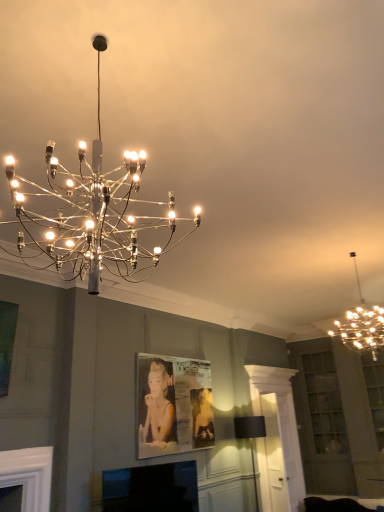
What is the approximate height of metallic chandelier at upper right, which ranks as the first lamp in right-to-left order?

metallic chandelier at upper right, which ranks as the first lamp in right-to-left order, is 4.23 feet tall.

The height and width of the screenshot is (512, 384). Identify the location of black glossy tv at lower center. (151, 488).

In order to face black fabric lampshade at lower center, placed as the third lamp when sorted from top to bottom, should I rotate leftwards or rightwards?

Rotate right and turn 8.089 degrees.

The image size is (384, 512). Find the location of `metallic silver picture frame at center`. metallic silver picture frame at center is located at coordinates (173, 405).

Is point (166, 472) positioned after point (26, 200)?

Yes.

Can you confirm if black glossy tv at lower center is wider than metallic chandelier at upper center, which is counted as the third lamp, starting from the right?

No.

Is black glossy tv at lower center to the right of metallic chandelier at upper center, placed as the 3th lamp when sorted from bottom to top, from the viewer's perspective?

Incorrect, black glossy tv at lower center is not on the right side of metallic chandelier at upper center, placed as the 3th lamp when sorted from bottom to top.

Who is taller, black glossy tv at lower center or metallic chandelier at upper center, the 1th lamp from the left?

metallic chandelier at upper center, the 1th lamp from the left.

Is metallic silver picture frame at center spatially inside black glossy tv at lower center, or outside of it?

metallic silver picture frame at center exists outside the volume of black glossy tv at lower center.

Does point (166, 430) appear closer or farther from the camera than point (176, 483)?

Point (166, 430) is positioned farther from the camera compared to point (176, 483).

Between metallic silver picture frame at center and black glossy tv at lower center, which one is positioned behind?

metallic silver picture frame at center is more distant.

Considering the sizes of metallic silver picture frame at center and metallic chandelier at upper right, marked as the second lamp in a bottom-to-top arrangement, in the image, is metallic silver picture frame at center wider or thinner than metallic chandelier at upper right, marked as the second lamp in a bottom-to-top arrangement,?

metallic silver picture frame at center is thinner than metallic chandelier at upper right, marked as the second lamp in a bottom-to-top arrangement.

Which of these two, metallic silver picture frame at center or metallic chandelier at upper right, the second lamp from the front, stands taller?

Standing taller between the two is metallic silver picture frame at center.

Which is more to the left, metallic silver picture frame at center or metallic chandelier at upper right, marked as the second lamp in a bottom-to-top arrangement?

From the viewer's perspective, metallic silver picture frame at center appears more on the left side.

Consider the image. Is metallic chandelier at upper right, which ranks as the first lamp in right-to-left order, far from black glossy tv at lower center?

metallic chandelier at upper right, which ranks as the first lamp in right-to-left order, is positioned a significant distance from black glossy tv at lower center.

Between metallic chandelier at upper right, which appears as the second lamp when viewed from the back, and black glossy tv at lower center, which one has smaller size?

black glossy tv at lower center.

Looking at this image, is black glossy tv at lower center located within metallic chandelier at upper right, which ranks as the 3th lamp in left-to-right order?

Definitely not — black glossy tv at lower center is not inside metallic chandelier at upper right, which ranks as the 3th lamp in left-to-right order.

Is metallic chandelier at upper right, which appears as the second lamp when viewed from the back, taller than black glossy tv at lower center?

Yes.

Which is more to the left, metallic silver picture frame at center or metallic chandelier at upper center, placed as the 3th lamp when sorted from bottom to top?

metallic chandelier at upper center, placed as the 3th lamp when sorted from bottom to top.

Are metallic silver picture frame at center and metallic chandelier at upper center, which is counted as the 1th lamp, starting from the top, located far from each other?

That's right, there is a large distance between metallic silver picture frame at center and metallic chandelier at upper center, which is counted as the 1th lamp, starting from the top.

From their relative heights in the image, would you say metallic silver picture frame at center is taller or shorter than metallic chandelier at upper center, placed as the 3th lamp when sorted from bottom to top?

Considering their sizes, metallic silver picture frame at center has less height than metallic chandelier at upper center, placed as the 3th lamp when sorted from bottom to top.

Is black glossy tv at lower center facing towards metallic silver picture frame at center?

No, black glossy tv at lower center is not aimed at metallic silver picture frame at center.

Considering the positions of point (137, 485) and point (204, 367), is point (137, 485) closer or farther from the camera than point (204, 367)?

Point (137, 485) is positioned closer to the camera compared to point (204, 367).

The image size is (384, 512). Find the location of `picture frame on the right side of black glossy tv at lower center`. picture frame on the right side of black glossy tv at lower center is located at coordinates (173, 405).

From the image's perspective, would you say black glossy tv at lower center is shown under metallic silver picture frame at center?

Yes.

Does point (117, 200) come behind point (330, 332)?

No, (117, 200) is closer to viewer.

Is metallic chandelier at upper center, placed as the 3th lamp when sorted from bottom to top, facing away from metallic chandelier at upper right, marked as the second lamp in a bottom-to-top arrangement?

No, metallic chandelier at upper center, placed as the 3th lamp when sorted from bottom to top, is not facing away from metallic chandelier at upper right, marked as the second lamp in a bottom-to-top arrangement.

Is metallic chandelier at upper center, placed as the 3th lamp when sorted from bottom to top, at the right side of metallic chandelier at upper right, which ranks as the first lamp in right-to-left order?

No.

Between metallic chandelier at upper center, the 1th lamp from the left, and metallic chandelier at upper right, arranged as the 2th lamp when viewed from the top, which one has larger width?

metallic chandelier at upper center, the 1th lamp from the left.

The width and height of the screenshot is (384, 512). Find the location of `lamp that is the 2nd object located in front of the black glossy tv at lower center`. lamp that is the 2nd object located in front of the black glossy tv at lower center is located at coordinates (90, 214).

The width and height of the screenshot is (384, 512). I want to click on picture frame behind the black glossy tv at lower center, so point(173,405).

Looking at the image, which one is located further to metallic chandelier at upper center, which is counted as the third lamp, starting from the right, metallic chandelier at upper right, marked as the second lamp in a bottom-to-top arrangement, or metallic silver picture frame at center?

Based on the image, metallic chandelier at upper right, marked as the second lamp in a bottom-to-top arrangement, appears to be further to metallic chandelier at upper center, which is counted as the third lamp, starting from the right.

From the image, which object appears to be farther from metallic chandelier at upper right, the second lamp from the front, black fabric lampshade at lower center, placed as the third lamp when sorted from top to bottom, or metallic chandelier at upper center, which is counted as the 1th lamp, starting from the top?

metallic chandelier at upper center, which is counted as the 1th lamp, starting from the top, lies further to metallic chandelier at upper right, the second lamp from the front, than the other object.

From the image, which object appears to be farther from metallic silver picture frame at center, black glossy tv at lower center or metallic chandelier at upper right, which ranks as the 3th lamp in left-to-right order?

Based on the image, metallic chandelier at upper right, which ranks as the 3th lamp in left-to-right order, appears to be further to metallic silver picture frame at center.

Looking at the image, which one is located closer to metallic chandelier at upper center, which is the first lamp in front-to-back order, black fabric lampshade at lower center, placed as the third lamp when sorted from front to back, or black glossy tv at lower center?

black glossy tv at lower center lies closer to metallic chandelier at upper center, which is the first lamp in front-to-back order, than the other object.

Looking at this image, estimate the real-world distances between objects in this image. Which object is closer to metallic chandelier at upper right, arranged as the 2th lamp when viewed from the top, black glossy tv at lower center or metallic silver picture frame at center?

Among the two, metallic silver picture frame at center is located nearer to metallic chandelier at upper right, arranged as the 2th lamp when viewed from the top.

When comparing their distances from black glossy tv at lower center, does metallic chandelier at upper right, which ranks as the first lamp in right-to-left order, or metallic silver picture frame at center seem further?

metallic chandelier at upper right, which ranks as the first lamp in right-to-left order, lies further to black glossy tv at lower center than the other object.

Estimate the real-world distances between objects in this image. Which object is closer to black glossy tv at lower center, metallic chandelier at upper center, which is counted as the 1th lamp, starting from the top, or metallic chandelier at upper right, the second lamp from the front?

metallic chandelier at upper center, which is counted as the 1th lamp, starting from the top.

Considering their positions, is black glossy tv at lower center positioned further to black fabric lampshade at lower center, marked as the 2th lamp in a left-to-right arrangement, than metallic silver picture frame at center?

Among the two, black glossy tv at lower center is located further to black fabric lampshade at lower center, marked as the 2th lamp in a left-to-right arrangement.

Find the location of a particular element. The width and height of the screenshot is (384, 512). lamp between metallic chandelier at upper center, which appears as the 3th lamp when viewed from the back, and metallic silver picture frame at center from front to back is located at coordinates (361, 325).

Find the location of a particular element. fireplace between metallic chandelier at upper right, which ranks as the 3th lamp in left-to-right order, and black fabric lampshade at lower center, which is the 1th lamp in back-to-front order, in the vertical direction is located at coordinates (151, 488).

At what (x,y) coordinates should I click in order to perform the action: click on picture frame located between black glossy tv at lower center and black fabric lampshade at lower center, arranged as the first lamp when ordered from the bottom, in the depth direction. Please return your answer as a coordinate pair (x, y). This screenshot has width=384, height=512. Looking at the image, I should click on (173, 405).

Where is `picture frame between metallic chandelier at upper center, placed as the 3th lamp when sorted from bottom to top, and black fabric lampshade at lower center, placed as the third lamp when sorted from top to bottom, in the front-back direction`? This screenshot has width=384, height=512. picture frame between metallic chandelier at upper center, placed as the 3th lamp when sorted from bottom to top, and black fabric lampshade at lower center, placed as the third lamp when sorted from top to bottom, in the front-back direction is located at coordinates (173, 405).